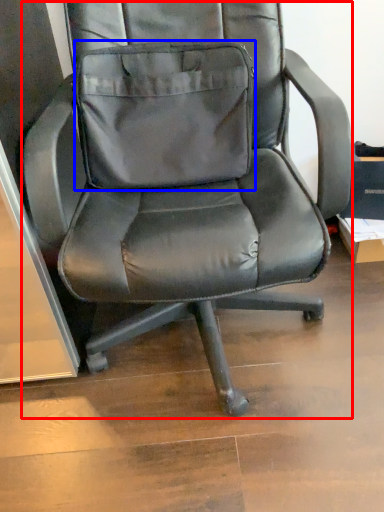
Question: Which point is closer to the camera, chair (highlighted by a red box) or pocket (highlighted by a blue box)?

Choices:
 (A) chair
 (B) pocket

Answer: (A)